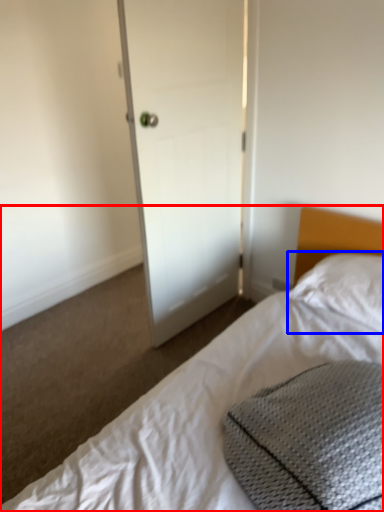
Question: Among these objects, which one is farthest to the camera, bed (highlighted by a red box) or pillow (highlighted by a blue box)?

Choices:
 (A) bed
 (B) pillow

Answer: (B)